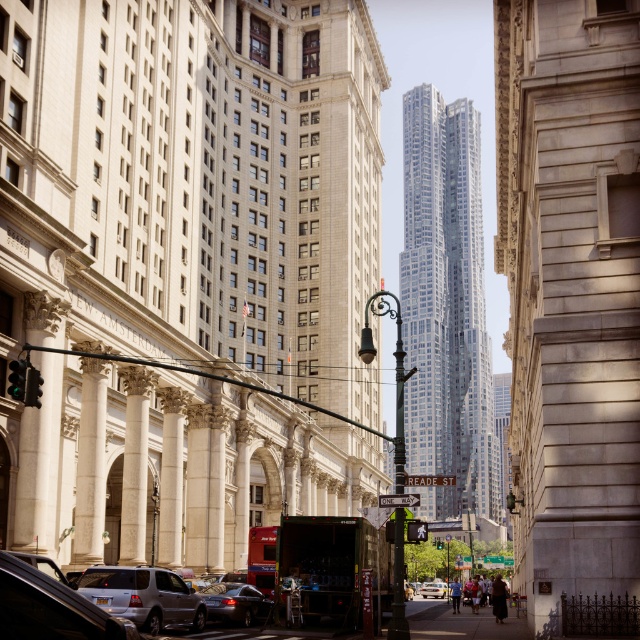
You are driving a car that is 5 meters long. You need to park your car between the silver metallic suv at lower left and the metallic rectangular traffic light at center. Is there enough space to park your car without moving either vehicle?

The distance between the silver metallic suv at lower left and the metallic rectangular traffic light at center is 13.44 meters. Since your car is 5 meters long, there is sufficient space to park without moving either vehicle.

You are a pedestrian standing on the sidewalk in front of the New Amsterdam building. You notice the polished metal streetlight at center and the green glass traffic light at left. Which object is closer to you?

The polished metal streetlight at center is closer to you because it is positioned further to the viewer than the green glass traffic light at left.